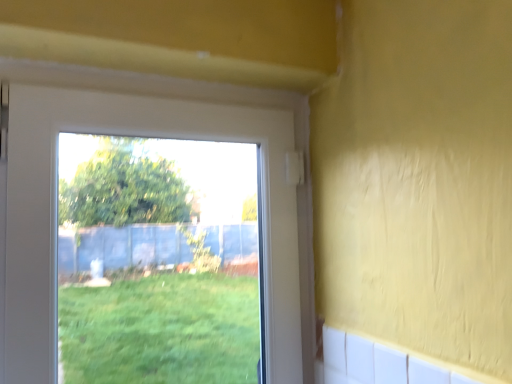
Question: Should I look upward or downward to see white plastic window at upper left?

Choices:
 (A) down
 (B) up

Answer: (A)